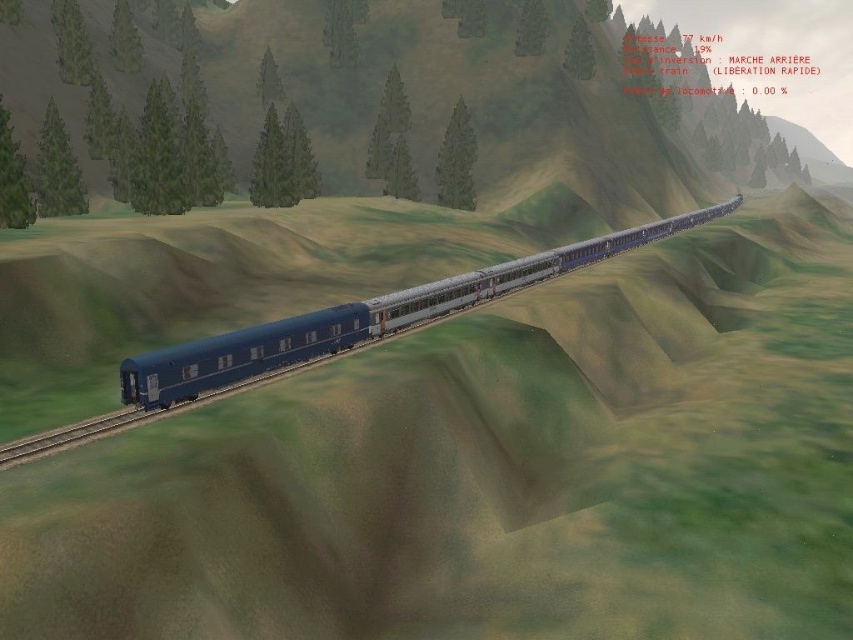
Question: Is metallic blue train at center positioned before gray metallic train track at lower left?

Choices:
 (A) yes
 (B) no

Answer: (B)

Question: Among these points, which one is nearest to the camera?

Choices:
 (A) (125, 403)
 (B) (6, 449)

Answer: (B)

Question: Among these points, which one is nearest to the camera?

Choices:
 (A) (120, 424)
 (B) (593, 250)

Answer: (A)

Question: Which point appears closest to the camera in this image?

Choices:
 (A) (32, 451)
 (B) (248, 365)

Answer: (A)

Question: Can you confirm if metallic blue train at center is wider than gray metallic train track at lower left?

Choices:
 (A) no
 (B) yes

Answer: (B)

Question: Does metallic blue train at center appear on the left side of gray metallic train track at lower left?

Choices:
 (A) yes
 (B) no

Answer: (B)